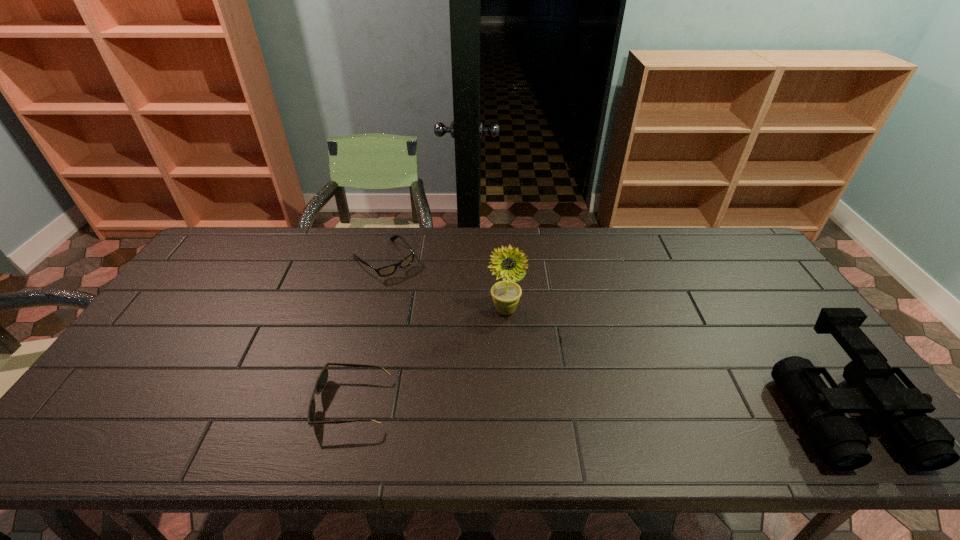
Locate an element on the screen. Image resolution: width=960 pixels, height=540 pixels. vacant space located on the front-facing side of the spectacles is located at coordinates (422, 296).

You are a GUI agent. You are given a task and a screenshot of the screen. Output one action in this format:
    pyautogui.click(x=<x>, y=<y>)
    Task: Click on the free space located on the front-facing side of the spectacles
    
    Given the screenshot: What is the action you would take?
    pyautogui.click(x=428, y=302)

This screenshot has height=540, width=960. I want to click on free location located on the face of the sunflower, so click(x=526, y=334).

The width and height of the screenshot is (960, 540). Identify the location of free space located on the face of the sunflower. (526, 334).

At what (x,y) coordinates should I click in order to perform the action: click on free point located 0.080m on the face of the sunflower. Please return your answer as a coordinate pair (x, y). This screenshot has height=540, width=960. Looking at the image, I should click on (530, 339).

You are a GUI agent. You are given a task and a screenshot of the screen. Output one action in this format:
    pyautogui.click(x=<x>, y=<y>)
    Task: Click on the object positioned at the far edge
    The height and width of the screenshot is (540, 960).
    Given the screenshot: What is the action you would take?
    [x=388, y=270]

Locate an element on the screen. sunglasses present at the near edge is located at coordinates (322, 379).

The image size is (960, 540). Find the location of `binoculars that is positioned at the near edge`. binoculars that is positioned at the near edge is located at coordinates (875, 389).

At what (x,y) coordinates should I click in order to perform the action: click on object that is at the right edge. Please return your answer as a coordinate pair (x, y). The image size is (960, 540). Looking at the image, I should click on (875, 389).

This screenshot has width=960, height=540. I want to click on object that is at the near right corner, so click(875, 389).